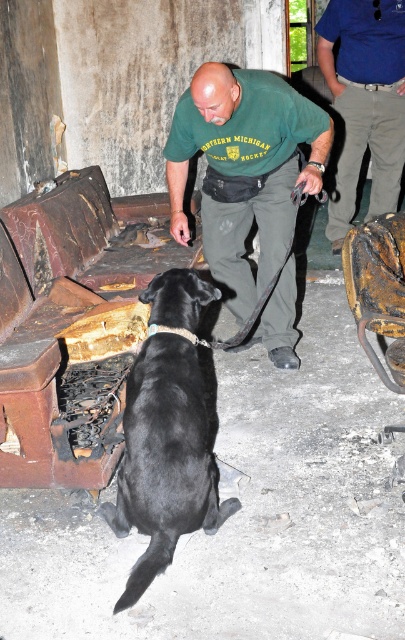
Does green fabric shirt at center have a greater height compared to blue cotton shirt at upper right?

No.

Identify the location of green fabric shirt at center. This screenshot has height=640, width=405. (243, 170).

You are a GUI agent. You are given a task and a screenshot of the screen. Output one action in this format:
    pyautogui.click(x=<x>, y=<y>)
    Task: Click on the green fabric shirt at center
    This screenshot has height=640, width=405.
    Given the screenshot: What is the action you would take?
    pyautogui.click(x=243, y=170)

Find the location of `green fabric shirt at center`. green fabric shirt at center is located at coordinates (243, 170).

Image resolution: width=405 pixels, height=640 pixels. I want to click on green fabric shirt at center, so click(x=243, y=170).

Which is in front, point (228, 221) or point (155, 566)?

Point (155, 566) is more forward.

Locate an element on the screen. The height and width of the screenshot is (640, 405). green fabric shirt at center is located at coordinates pyautogui.click(x=243, y=170).

Is black smooth fur dog at center below blue cotton shirt at upper right?

Correct, black smooth fur dog at center is located below blue cotton shirt at upper right.

I want to click on black smooth fur dog at center, so click(164, 458).

The height and width of the screenshot is (640, 405). Describe the element at coordinates (164, 458) in the screenshot. I see `black smooth fur dog at center` at that location.

What are the coordinates of `black smooth fur dog at center` in the screenshot? It's located at (164, 458).